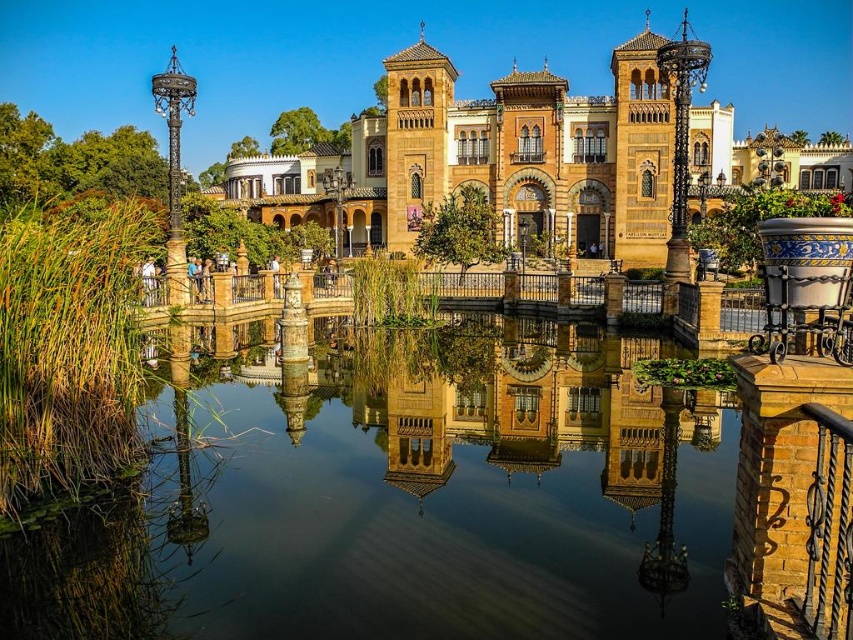
Question: In this image, where is transparent water at center located relative to brown stone palace at center?

Choices:
 (A) below
 (B) above

Answer: (A)

Question: Where is transparent water at center located in relation to brown stone palace at center in the image?

Choices:
 (A) right
 (B) left

Answer: (B)

Question: Can you confirm if transparent water at center is positioned below brown stone palace at center?

Choices:
 (A) yes
 (B) no

Answer: (A)

Question: Which point appears farthest from the camera in this image?

Choices:
 (A) (202, 380)
 (B) (720, 125)

Answer: (B)